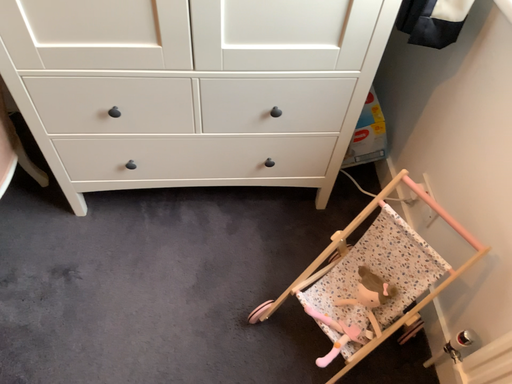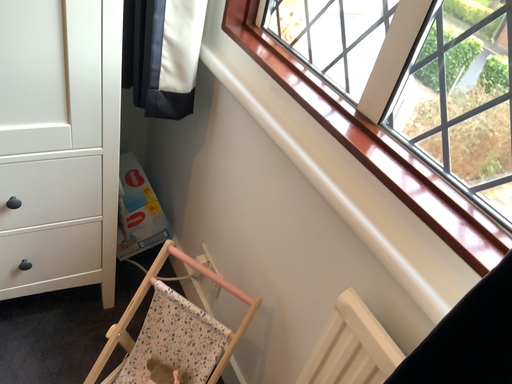
Question: How did the camera likely rotate when shooting the video?

Choices:
 (A) rotated downward
 (B) rotated upward

Answer: (B)